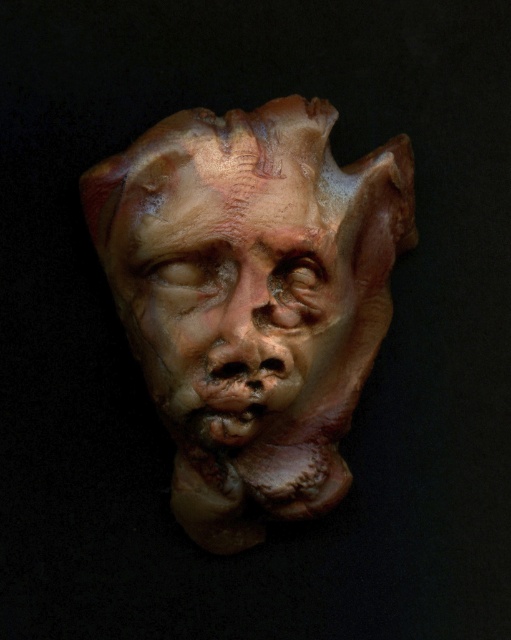
You are an art conservator working with two masks displayed in a gallery. The first is a matte clay mask at center, and the second is a matte brown mask at center. The curator wants to place them side by side on a shelf that is 1.5 inches wide. Can both masks fit without overlapping?

The matte clay mask at center is 0.75 inches away from matte brown mask at center. Since the total space required between them is 0.75 inches and the shelf is 1.5 inches wide, there will be enough space for both masks to fit without overlapping.

You are an art curator examining two masks displayed side by side in a gallery. The first is a matte clay mask at center, and the second is a matte brown mask at center. Based on their positions in the image, which mask appears taller?

The matte clay mask at center appears taller than the matte brown mask at center.

You are an art curator examining two masks displayed side by side in a gallery. The first is a matte clay mask at center, and the second is a matte brown mask at center. Based on their placement, which mask do you think is wider?

The matte clay mask at center is wider than the matte brown mask at center according to the description.